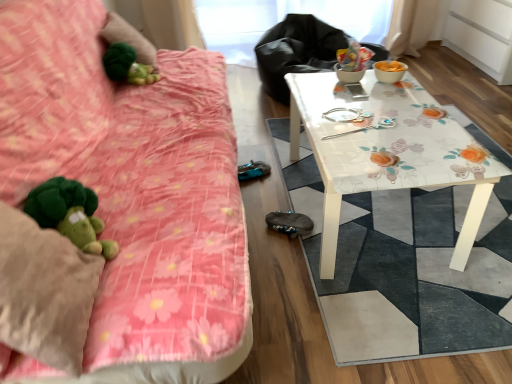
You are a GUI agent. You are given a task and a screenshot of the screen. Output one action in this format:
    pyautogui.click(x=<x>, y=<y>)
    Task: Click on the empty space that is to the right of metallic silver spoon at center
    Image resolution: width=512 pixels, height=384 pixels.
    Given the screenshot: What is the action you would take?
    pyautogui.click(x=412, y=129)